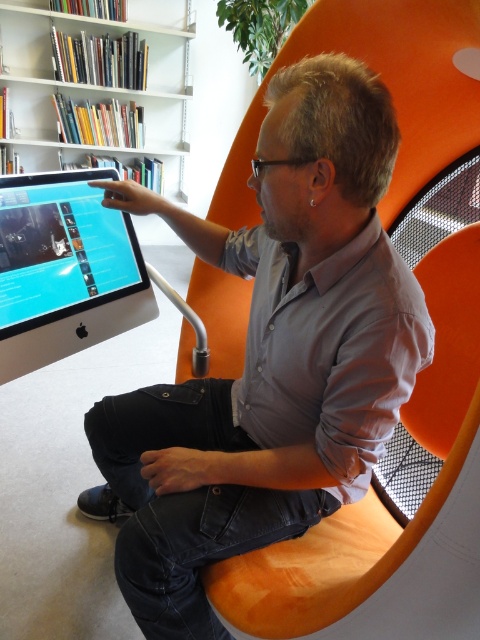
Is orange wood swivel chair at center positioned behind matte black monitor at left?

No, it is in front of matte black monitor at left.

Is orange wood swivel chair at center wider than matte black monitor at left?

Yes, orange wood swivel chair at center is wider than matte black monitor at left.

Who is more forward, (x=279, y=547) or (x=45, y=234)?

Point (x=279, y=547) is more forward.

The height and width of the screenshot is (640, 480). Find the location of `orange wood swivel chair at center`. orange wood swivel chair at center is located at coordinates (387, 509).

Who is higher up, white glossy bookshelf at upper left or matte black monitor at left?

Positioned higher is white glossy bookshelf at upper left.

What do you see at coordinates (94, 93) in the screenshot? I see `white glossy bookshelf at upper left` at bounding box center [94, 93].

Identify the location of white glossy bookshelf at upper left. (94, 93).

Is orange wood swivel chair at center above white glossy bookshelf at upper left?

No, orange wood swivel chair at center is not above white glossy bookshelf at upper left.

Based on the photo, does orange wood swivel chair at center come behind white glossy bookshelf at upper left?

No, it is in front of white glossy bookshelf at upper left.

Find the location of a particular element. orange wood swivel chair at center is located at coordinates (387, 509).